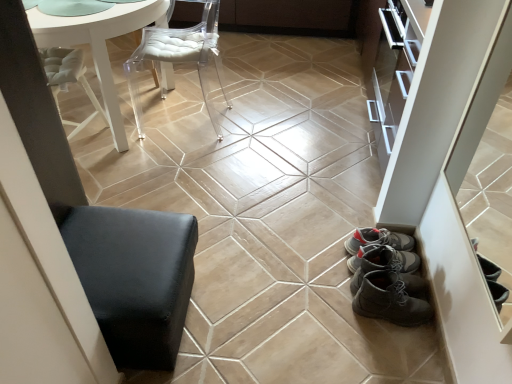
Question: Considering the relative sizes of beige glossy ceramic tile at center and white glossy table at upper left in the image provided, is beige glossy ceramic tile at center bigger than white glossy table at upper left?

Choices:
 (A) no
 (B) yes

Answer: (A)

Question: Is beige glossy ceramic tile at center further to camera compared to white glossy table at upper left?

Choices:
 (A) no
 (B) yes

Answer: (A)

Question: From a real-world perspective, is beige glossy ceramic tile at center beneath white glossy table at upper left?

Choices:
 (A) no
 (B) yes

Answer: (B)

Question: Is white glossy table at upper left inside beige glossy ceramic tile at center?

Choices:
 (A) yes
 (B) no

Answer: (B)

Question: Considering the relative positions of beige glossy ceramic tile at center and white glossy table at upper left in the image provided, is beige glossy ceramic tile at center in front of white glossy table at upper left?

Choices:
 (A) no
 (B) yes

Answer: (B)

Question: From the image's perspective, would you say beige glossy ceramic tile at center is positioned over white glossy table at upper left?

Choices:
 (A) no
 (B) yes

Answer: (A)

Question: Is beige glossy ceramic tile at center smaller than transparent acrylic chair at upper center?

Choices:
 (A) yes
 (B) no

Answer: (A)

Question: Is the depth of beige glossy ceramic tile at center less than that of transparent acrylic chair at upper center?

Choices:
 (A) yes
 (B) no

Answer: (A)

Question: From the image's perspective, is beige glossy ceramic tile at center located above transparent acrylic chair at upper center?

Choices:
 (A) yes
 (B) no

Answer: (B)

Question: Does beige glossy ceramic tile at center have a larger size compared to transparent acrylic chair at upper center?

Choices:
 (A) no
 (B) yes

Answer: (A)

Question: From a real-world perspective, is beige glossy ceramic tile at center on transparent acrylic chair at upper center?

Choices:
 (A) yes
 (B) no

Answer: (B)

Question: Is beige glossy ceramic tile at center aimed at transparent acrylic chair at upper center?

Choices:
 (A) no
 (B) yes

Answer: (A)

Question: From the image's perspective, is beige glossy ceramic tile at center beneath black leather ottoman at lower left?

Choices:
 (A) yes
 (B) no

Answer: (B)